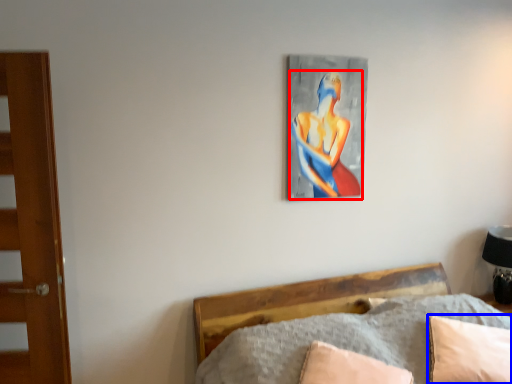
Question: Which point is closer to the camera, person (highlighted by a red box) or pillow (highlighted by a blue box)?

Choices:
 (A) person
 (B) pillow

Answer: (B)